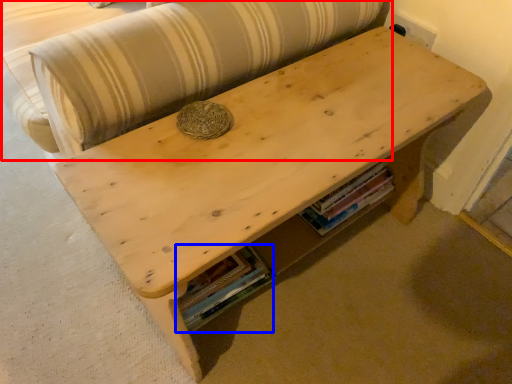
Question: Which point is further to the camera, couch (highlighted by a red box) or book (highlighted by a blue box)?

Choices:
 (A) couch
 (B) book

Answer: (B)